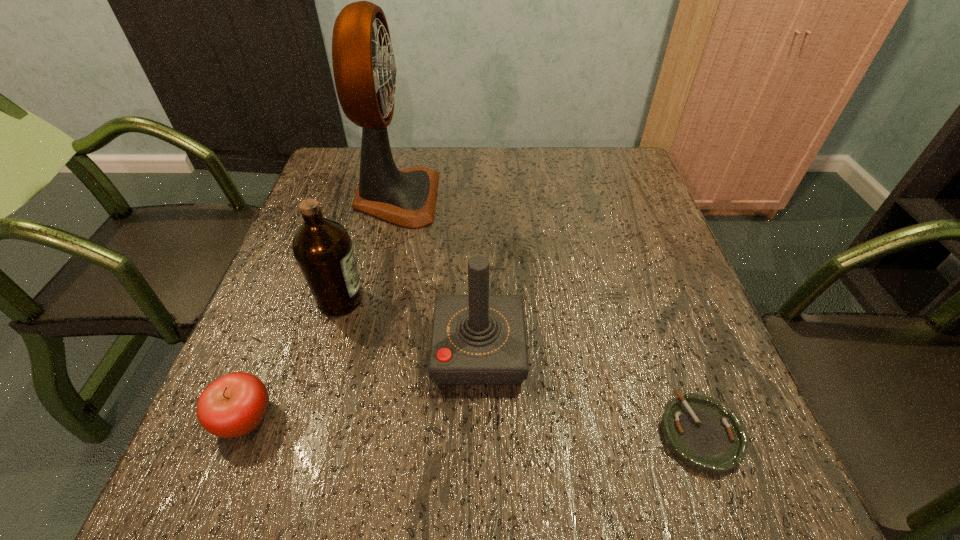
Identify the location of fan. (364, 68).

In order to click on the tallest object in this screenshot , I will do `click(364, 68)`.

The width and height of the screenshot is (960, 540). I want to click on olive oil, so click(323, 250).

You are a GUI agent. You are given a task and a screenshot of the screen. Output one action in this format:
    pyautogui.click(x=<x>, y=<y>)
    Task: Click on the second object from right to left
    The width and height of the screenshot is (960, 540).
    Given the screenshot: What is the action you would take?
    pyautogui.click(x=477, y=339)

What are the coordinates of `apple` in the screenshot? It's located at (235, 404).

What are the coordinates of `ashtray` in the screenshot? It's located at (702, 434).

Locate an element on the screen. Image resolution: width=960 pixels, height=540 pixels. the shortest object is located at coordinates (702, 434).

In order to click on free spot located 0.150m on the front-facing side of the tallest object in this screenshot , I will do `click(492, 198)`.

Identify the location of free spot located on the label of the olive oil. This screenshot has width=960, height=540. (537, 300).

In order to click on vacant space located on the rectangular base of the second object from right to left in this screenshot , I will do `click(697, 349)`.